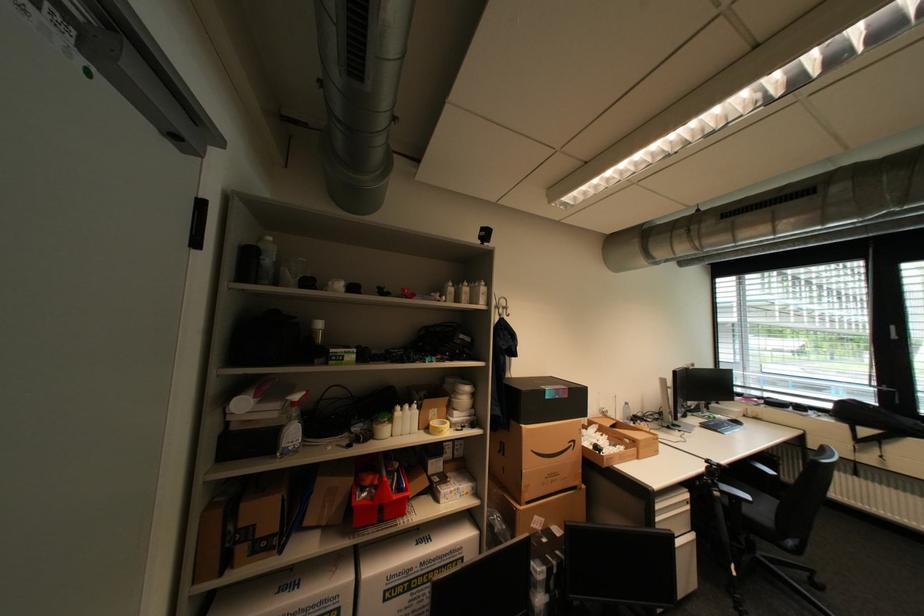
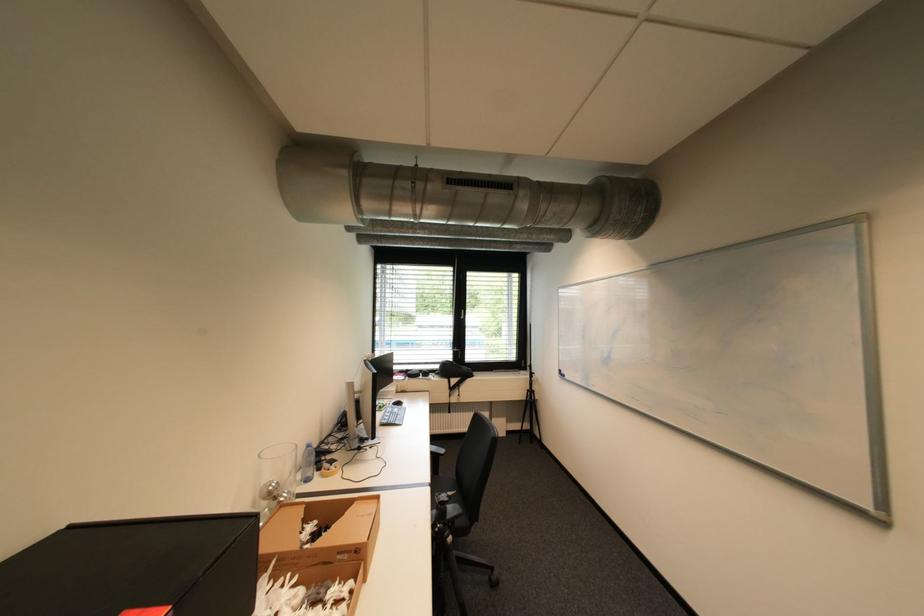
Locate, in the second image, the point that corresponds to (725,416) in the first image.

(393, 403)